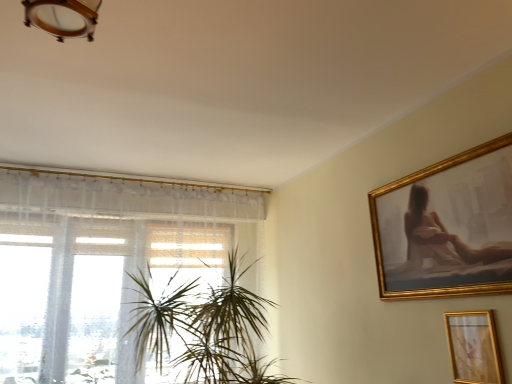
Question: Is green leafy plant at center next to white sheer curtain at left?

Choices:
 (A) no
 (B) yes

Answer: (A)

Question: Could you tell me if green leafy plant at center is facing white sheer curtain at left?

Choices:
 (A) yes
 (B) no

Answer: (B)

Question: Does green leafy plant at center contain white sheer curtain at left?

Choices:
 (A) no
 (B) yes

Answer: (A)

Question: From the image's perspective, is green leafy plant at center under white sheer curtain at left?

Choices:
 (A) yes
 (B) no

Answer: (A)

Question: Would you say green leafy plant at center is outside white sheer curtain at left?

Choices:
 (A) yes
 (B) no

Answer: (A)

Question: From a real-world perspective, is white sheer curtain at left above or below green leafy plant at center?

Choices:
 (A) below
 (B) above

Answer: (B)

Question: Is white sheer curtain at left in front of or behind green leafy plant at center in the image?

Choices:
 (A) behind
 (B) front

Answer: (A)

Question: In terms of height, does white sheer curtain at left look taller or shorter compared to green leafy plant at center?

Choices:
 (A) short
 (B) tall

Answer: (B)

Question: Considering the positions of point (94, 357) and point (146, 286), is point (94, 357) closer or farther from the camera than point (146, 286)?

Choices:
 (A) closer
 (B) farther

Answer: (B)

Question: Would you say white sheer curtain at left is inside or outside gold metallic picture frame at lower right?

Choices:
 (A) inside
 (B) outside

Answer: (B)

Question: Is white sheer curtain at left taller or shorter than gold metallic picture frame at lower right?

Choices:
 (A) tall
 (B) short

Answer: (A)

Question: Is point (221, 216) positioned closer to the camera than point (500, 377)?

Choices:
 (A) closer
 (B) farther

Answer: (B)

Question: Considering their positions, is white sheer curtain at left located in front of or behind gold metallic picture frame at lower right?

Choices:
 (A) behind
 (B) front

Answer: (A)

Question: Would you say green leafy plant at center is to the left or to the right of gold metallic picture frame at lower right in the picture?

Choices:
 (A) right
 (B) left

Answer: (B)

Question: Does point (181, 314) appear closer or farther from the camera than point (454, 352)?

Choices:
 (A) closer
 (B) farther

Answer: (B)